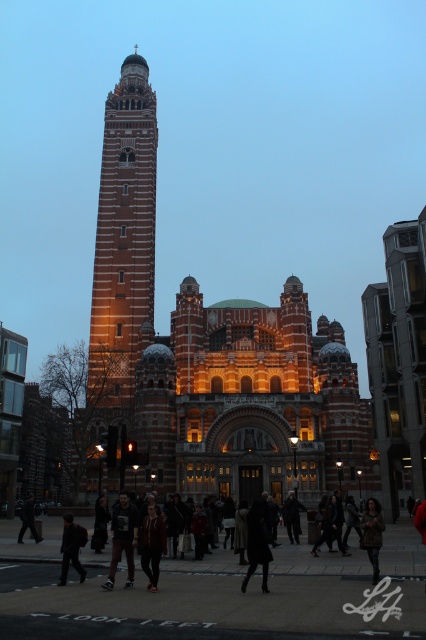
Who is positioned more to the right, brick tower at center or dark brown leather jacket at lower center?

dark brown leather jacket at lower center is more to the right.

Is brick tower at center further to the viewer compared to dark brown leather jacket at lower center?

Yes, brick tower at center is behind dark brown leather jacket at lower center.

Describe the element at coordinates (123, 236) in the screenshot. I see `brick tower at center` at that location.

Find the location of a particular element. This screenshot has height=640, width=426. brick tower at center is located at coordinates (123, 236).

Does camouflage-patterned coat at lower center have a larger size compared to dark gray jacket at lower left?

Yes, camouflage-patterned coat at lower center is bigger than dark gray jacket at lower left.

Which is more to the right, camouflage-patterned coat at lower center or dark gray jacket at lower left?

camouflage-patterned coat at lower center

Is point (368, 502) more distant than point (63, 579)?

That is True.

Where is `camouflage-patterned coat at lower center`? The width and height of the screenshot is (426, 640). camouflage-patterned coat at lower center is located at coordinates (373, 532).

Consider the image. Is dark gray hoodie at center below dark brown leather coat at center?

Yes.

Between dark gray hoodie at center and dark brown leather coat at center, which one appears on the right side from the viewer's perspective?

Positioned to the right is dark brown leather coat at center.

Locate an element on the screen. dark gray hoodie at center is located at coordinates (123, 538).

Locate an element on the screen. dark gray hoodie at center is located at coordinates (123, 538).